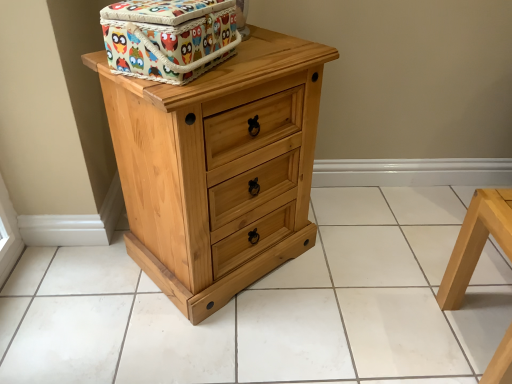
The height and width of the screenshot is (384, 512). I want to click on free location to the right of multicolored fabric box at upper center, so click(x=266, y=62).